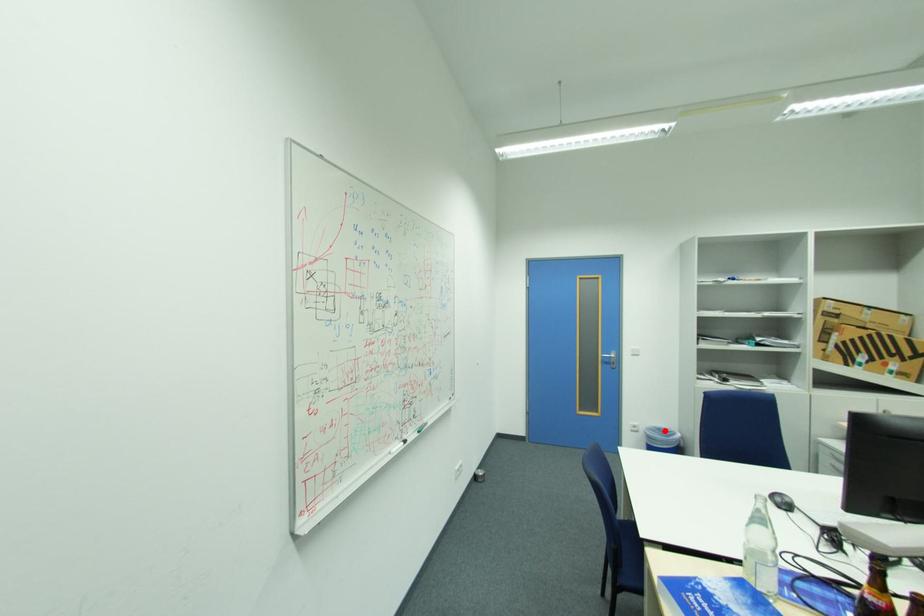
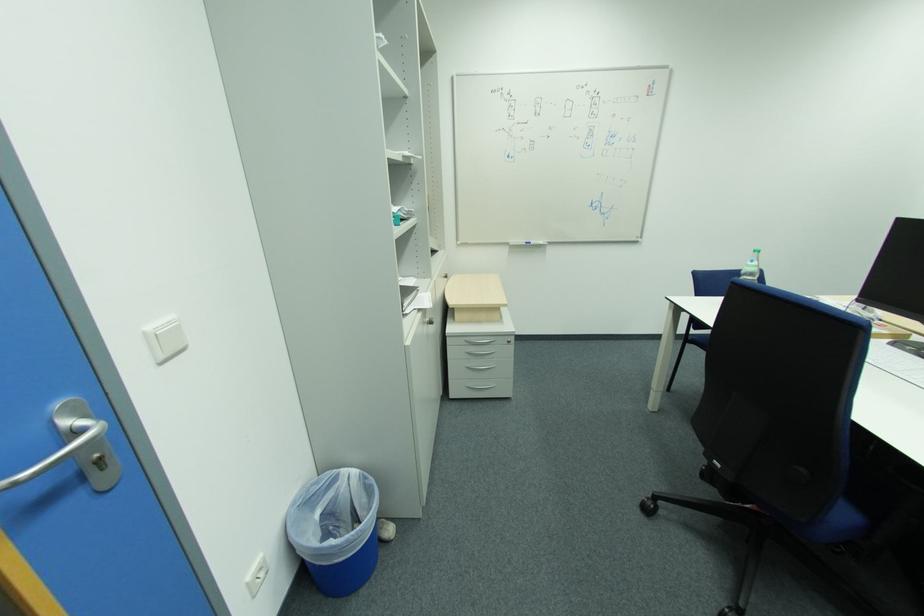
Find the pixel in the second image that matches the highlighted location in the first image.

(304, 507)